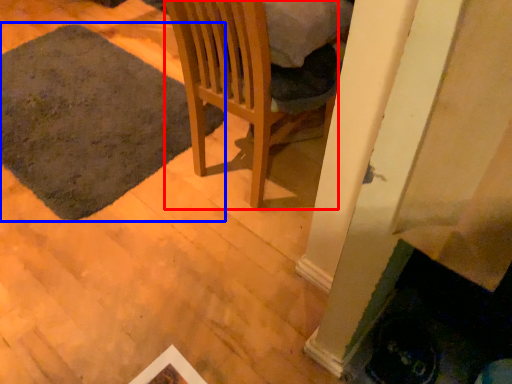
Question: Which object appears closest to the camera in this image, chair (highlighted by a red box) or mat (highlighted by a blue box)?

Choices:
 (A) chair
 (B) mat

Answer: (A)